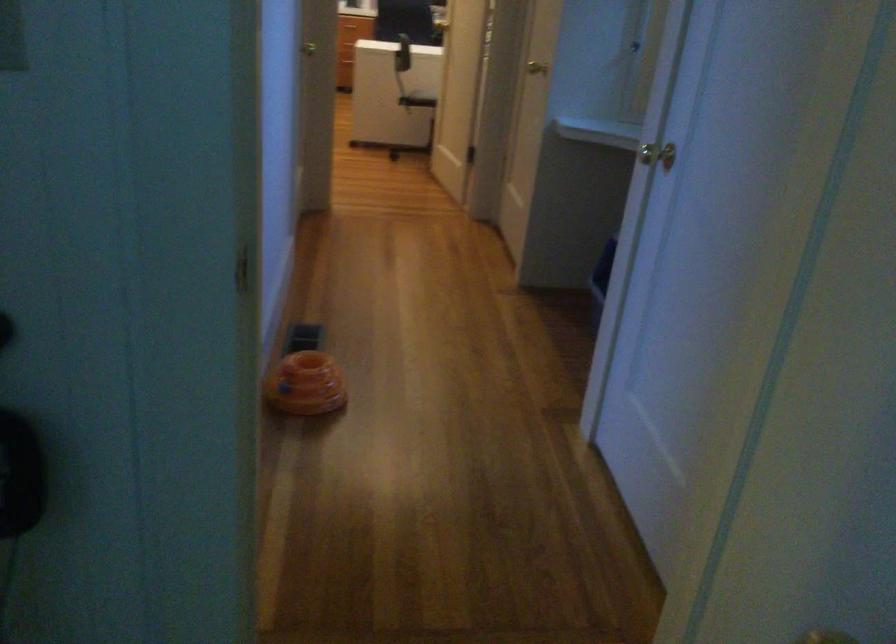
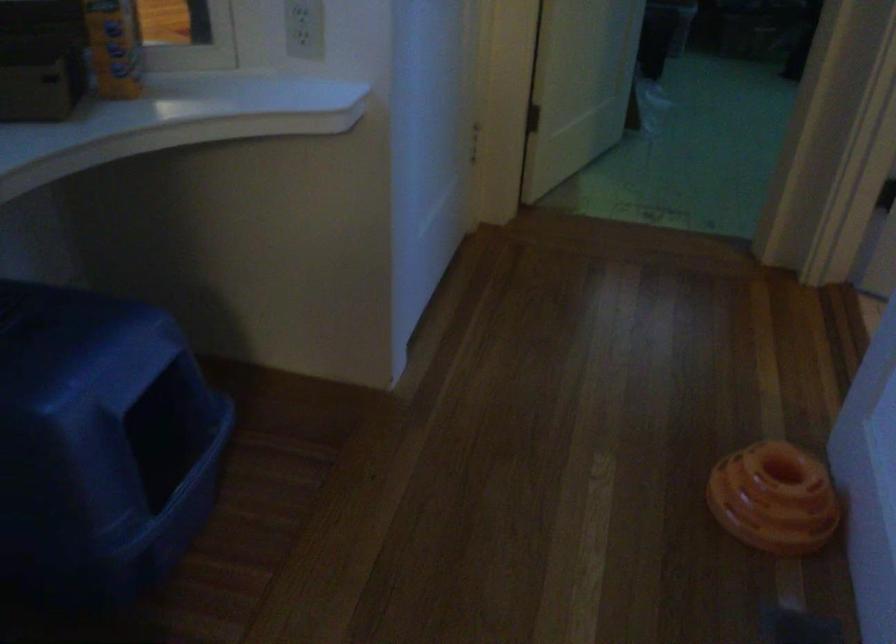
Find the pixel in the second image that matches point (328, 364) in the first image.

(773, 498)